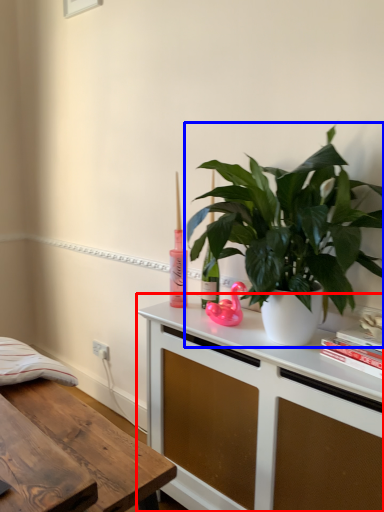
Question: Among these objects, which one is farthest to the camera, cabinetry (highlighted by a red box) or houseplant (highlighted by a blue box)?

Choices:
 (A) cabinetry
 (B) houseplant

Answer: (A)